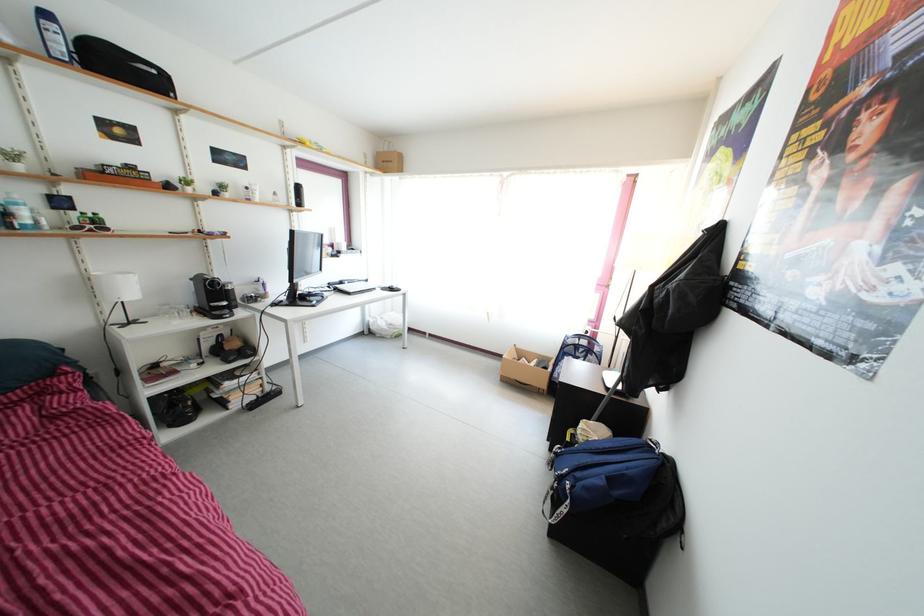
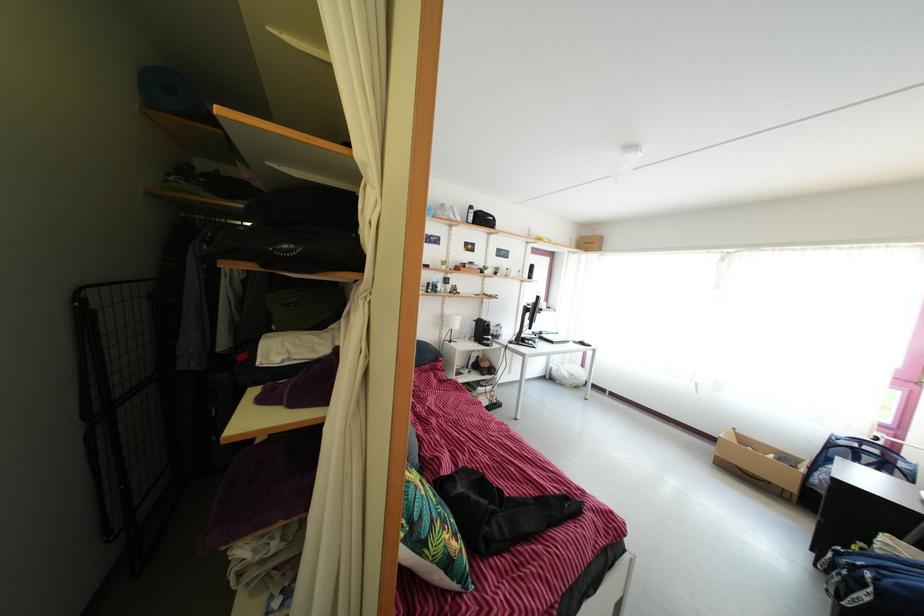
Find the pixel in the second image that matches pixel 570 517 in the first image.

(870, 605)